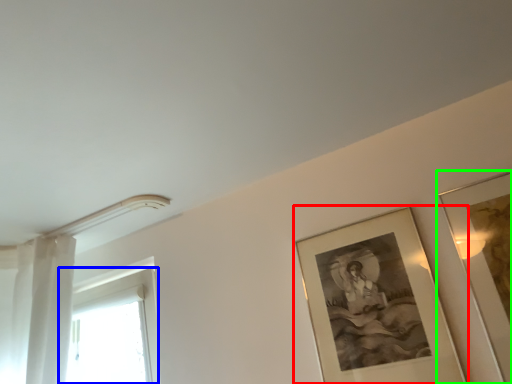
Question: Considering the real-world distances, which object is closest to picture frame (highlighted by a red box)? window (highlighted by a blue box) or picture frame (highlighted by a green box).

Choices:
 (A) window
 (B) picture frame

Answer: (B)